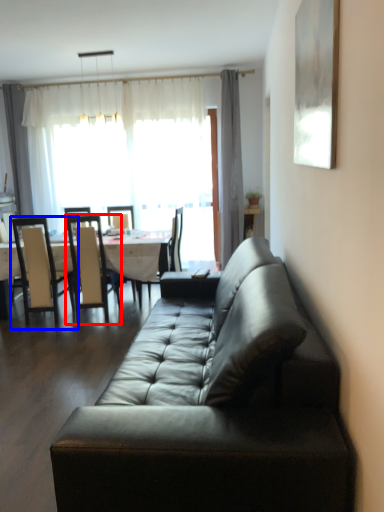
Question: Which of the following is the farthest to the observer, chair (highlighted by a red box) or chair (highlighted by a blue box)?

Choices:
 (A) chair
 (B) chair

Answer: (A)